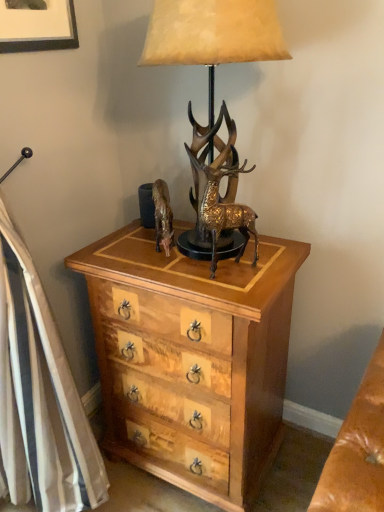
Locate an element on the screen. This screenshot has height=512, width=384. free space on the front side of gold metallic horse at center is located at coordinates pyautogui.click(x=164, y=269).